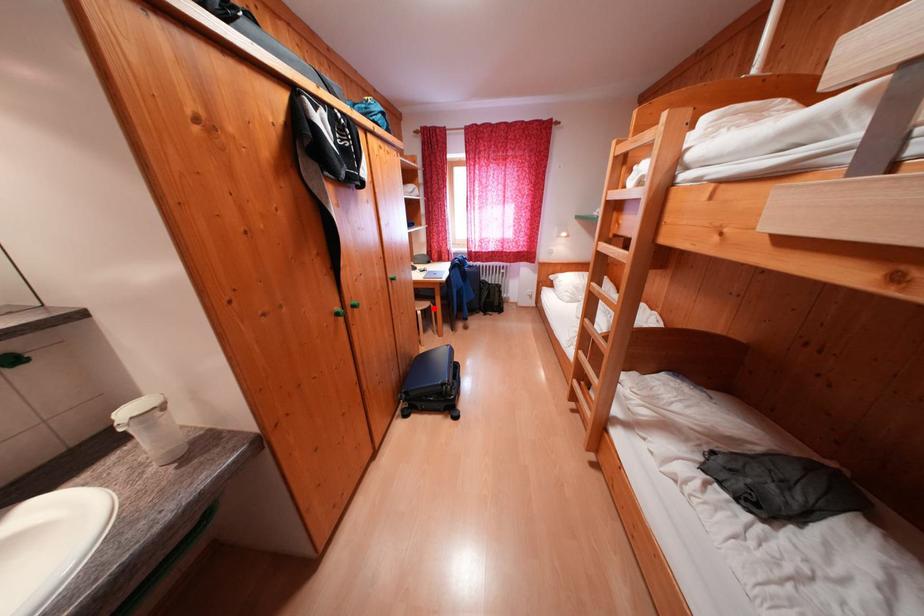
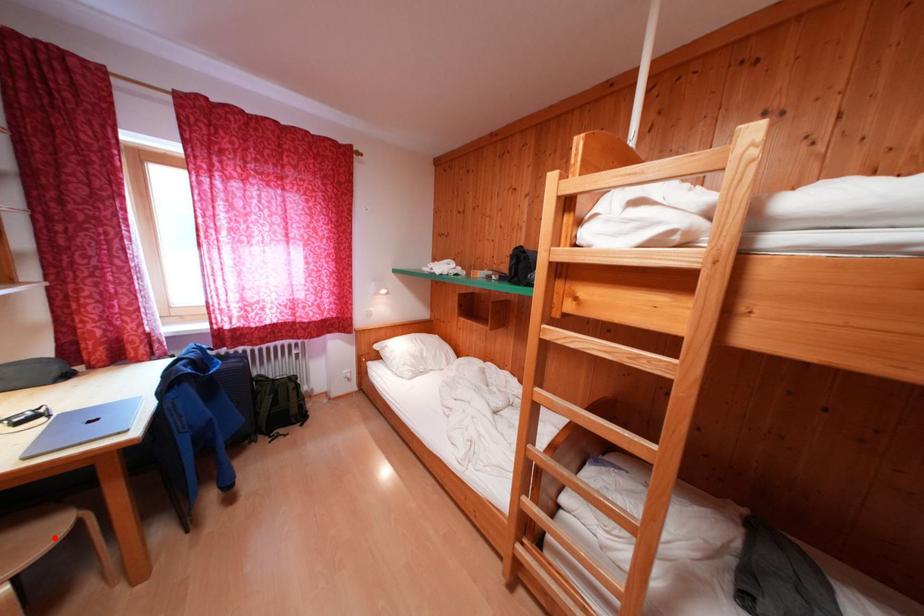
I am providing you with two images of the same scene from different viewpoints. A red point is marked on the first image and another point is marked on the second image. Are the points marked in image1 and image2 representing the same 3D position?

Yes